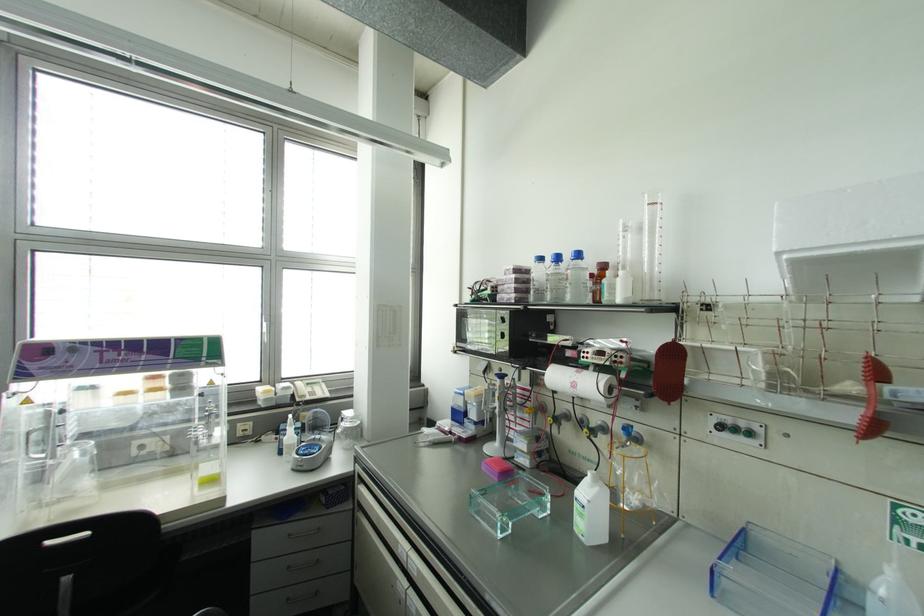
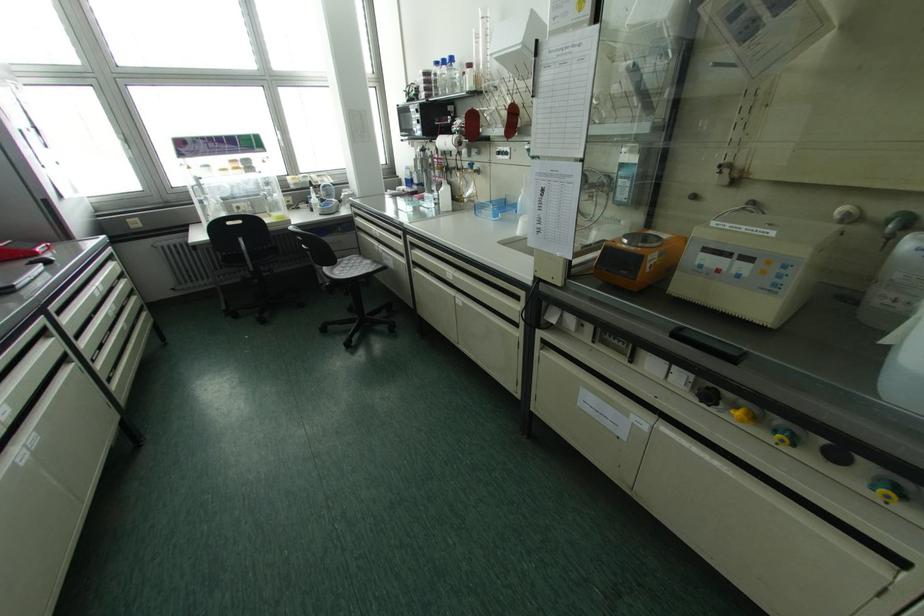
Find the pixel in the second image that matches pixel 578 254 in the first image.

(451, 59)